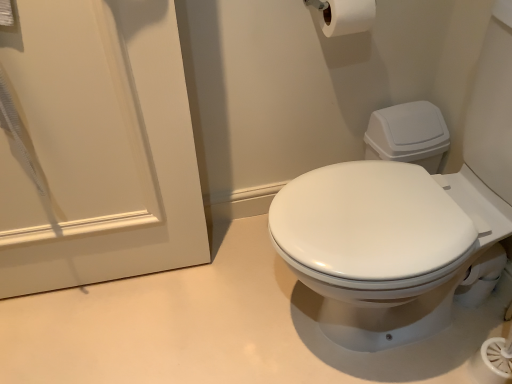
You are a GUI agent. You are given a task and a screenshot of the screen. Output one action in this format:
    pyautogui.click(x=<x>, y=<y>)
    Task: Click on the space that is in front of white matte door at upper left
    This screenshot has width=512, height=384.
    Given the screenshot: What is the action you would take?
    pyautogui.click(x=98, y=335)